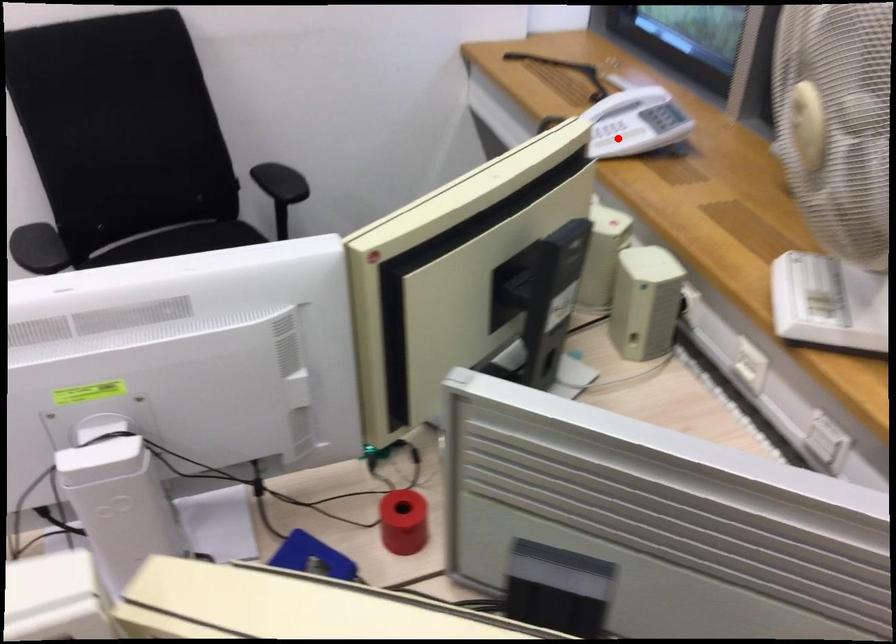
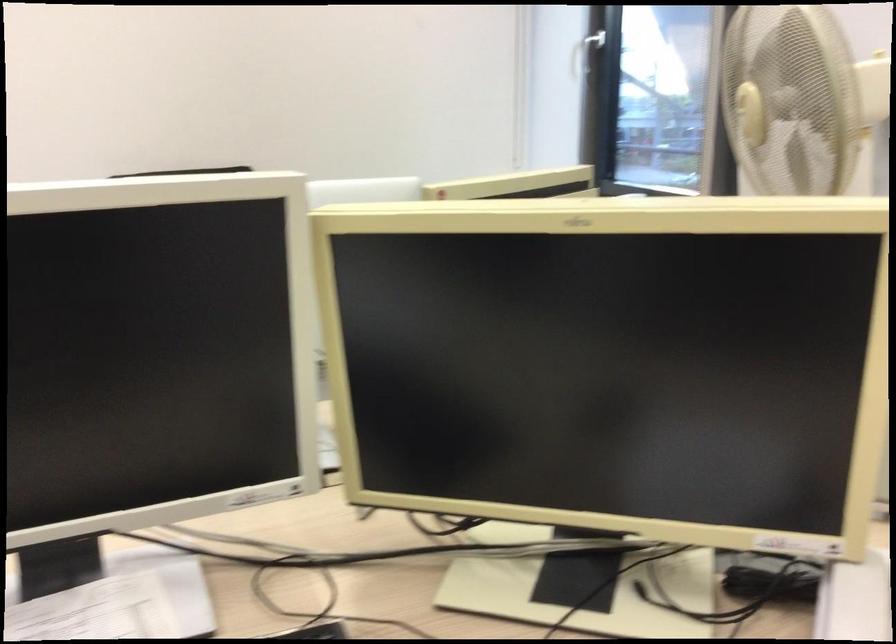
Question: I am providing you with two images of the same scene from different viewpoints. A red point is marked on the first image. Can you still see the location of the red point in image 2?

Choices:
 (A) Yes
 (B) No

Answer: (B)